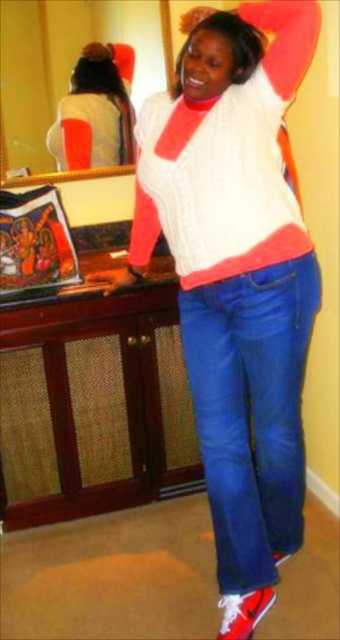
Consider the image. Who is more forward, (88, 145) or (127, 268)?

Point (127, 268) is in front.

Does point (87, 160) come behind point (104, 280)?

Yes.

This screenshot has height=640, width=340. I want to click on white knit sweater at upper center, so click(95, 109).

Does white knit sweater at center have a lesser height compared to denim jeans at lower center?

In fact, white knit sweater at center may be taller than denim jeans at lower center.

Locate an element on the screen. white knit sweater at center is located at coordinates (236, 278).

This screenshot has height=640, width=340. In order to click on white knit sweater at center in this screenshot , I will do `click(236, 278)`.

Who is higher up, denim jeans at lower center or matte black handbag at lower left?

matte black handbag at lower left is above.

How far apart are denim jeans at lower center and matte black handbag at lower left?

denim jeans at lower center and matte black handbag at lower left are 28.40 inches apart.

What are the coordinates of `denim jeans at lower center` in the screenshot? It's located at (251, 410).

Where is `denim jeans at lower center`? This screenshot has height=640, width=340. denim jeans at lower center is located at coordinates (251, 410).